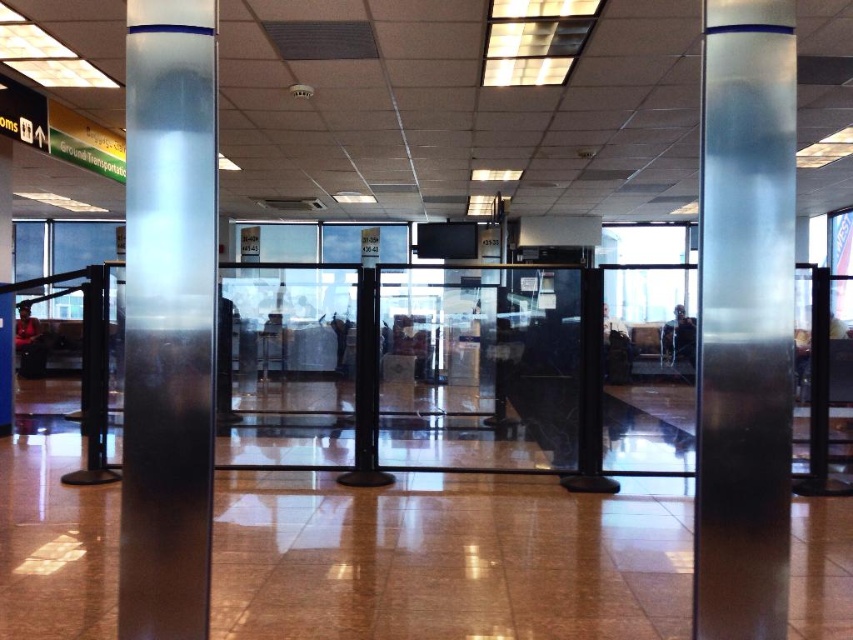
Question: Which point is farther to the camera?

Choices:
 (A) (125, 483)
 (B) (738, 504)

Answer: (A)

Question: Which of the following is the farthest from the observer?

Choices:
 (A) satin silver pole at center
 (B) satin silver column at center

Answer: (A)

Question: Can you confirm if satin silver column at center is wider than satin silver pole at center?

Choices:
 (A) yes
 (B) no

Answer: (A)

Question: Can you confirm if satin silver column at center is bigger than satin silver pole at center?

Choices:
 (A) yes
 (B) no

Answer: (A)

Question: Is the position of satin silver column at center more distant than that of satin silver pole at center?

Choices:
 (A) yes
 (B) no

Answer: (B)